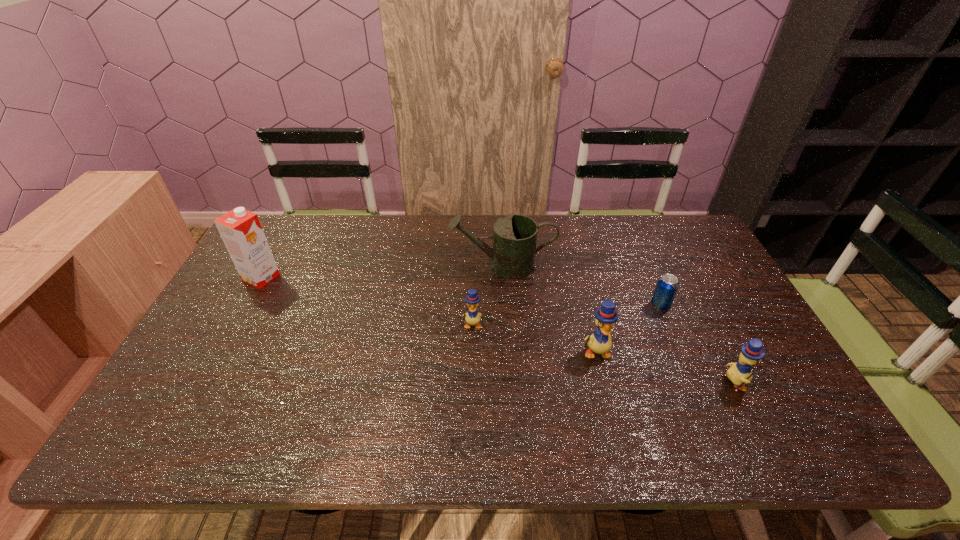
Please point a free position for a duckling on the left. Please provide its 2D coordinates. Your answer should be formatted as a tuple, i.e. [(x, y)], where the tuple contains the x and y coordinates of a point satisfying the conditions above.

[(362, 300)]